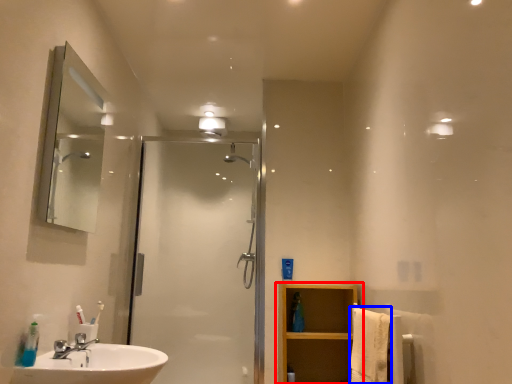
Question: Which object is closer to the camera taking this photo, bathroom cabinet (highlighted by a red box) or bath towel (highlighted by a blue box)?

Choices:
 (A) bathroom cabinet
 (B) bath towel

Answer: (B)